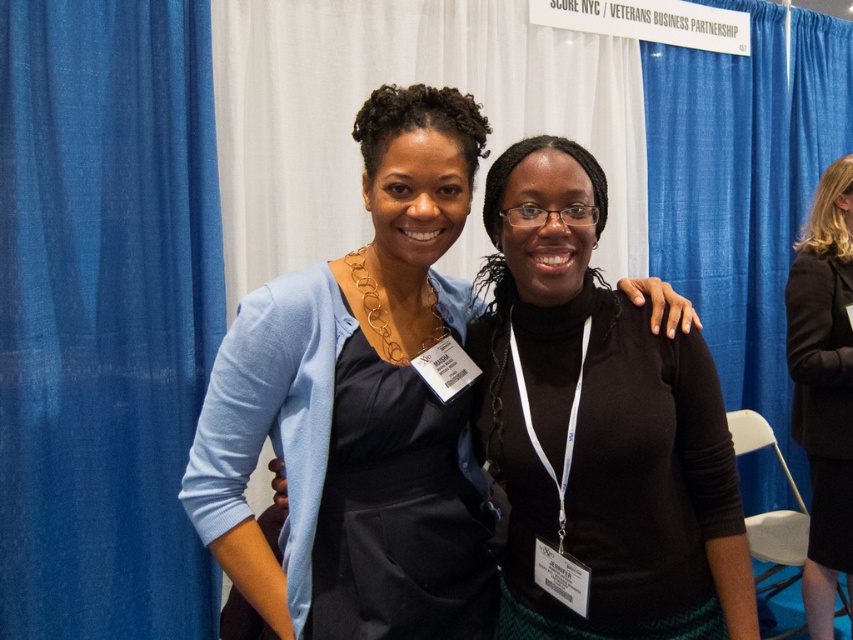
You are at a networking event and need to introduce yourself to both individuals wearing the matte blue cardigan at center and the dark brown wool coat at right. Which person should you approach first if you want to greet them in order from left to right?

The matte blue cardigan at center is to the left of the dark brown wool coat at right, so you should approach the person wearing the matte blue cardigan at center first.

You are attending a conference and need to move from the blue fabric curtain at left to the dark brown wool coat at right. Which direction should you move to reach the coat?

To move from the blue fabric curtain at left to the dark brown wool coat at right, you should move to the right since the coat is positioned to the right of the curtain.